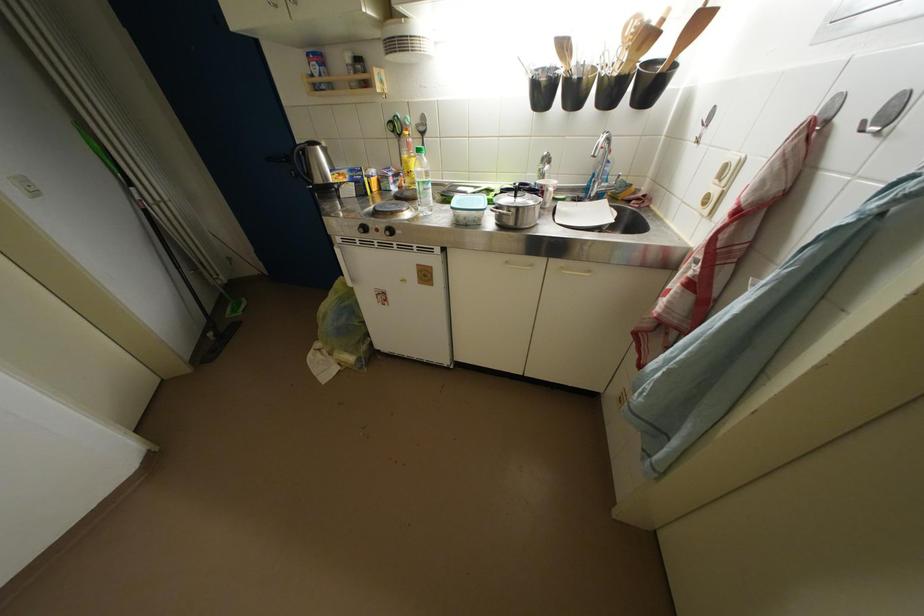
Locate an element on the screen. Image resolution: width=924 pixels, height=616 pixels. clear water bottle is located at coordinates (422, 182).